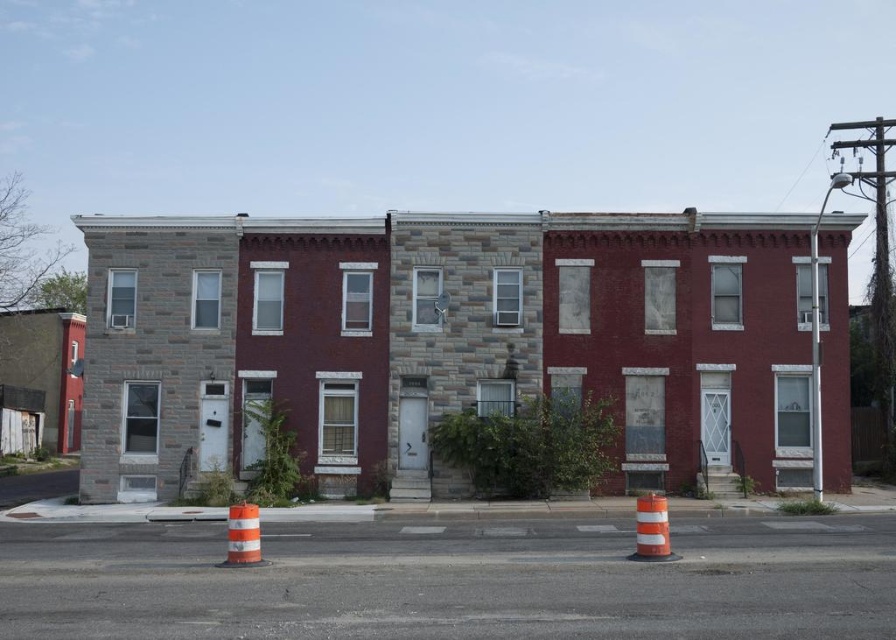
Question: Which point appears farthest from the camera in this image?

Choices:
 (A) (230, 561)
 (B) (651, 531)

Answer: (A)

Question: Does orange striped traffic cone at center have a lesser width compared to orange/white striped traffic cone at lower center?

Choices:
 (A) yes
 (B) no

Answer: (B)

Question: Considering the relative positions of orange striped traffic cone at center and orange/white striped traffic cone at lower center in the image provided, where is orange striped traffic cone at center located with respect to orange/white striped traffic cone at lower center?

Choices:
 (A) above
 (B) below

Answer: (B)

Question: Among these points, which one is farthest from the camera?

Choices:
 (A) (234, 540)
 (B) (666, 529)

Answer: (A)

Question: Is orange striped traffic cone at center positioned at the back of orange/white striped traffic cone at lower center?

Choices:
 (A) no
 (B) yes

Answer: (A)